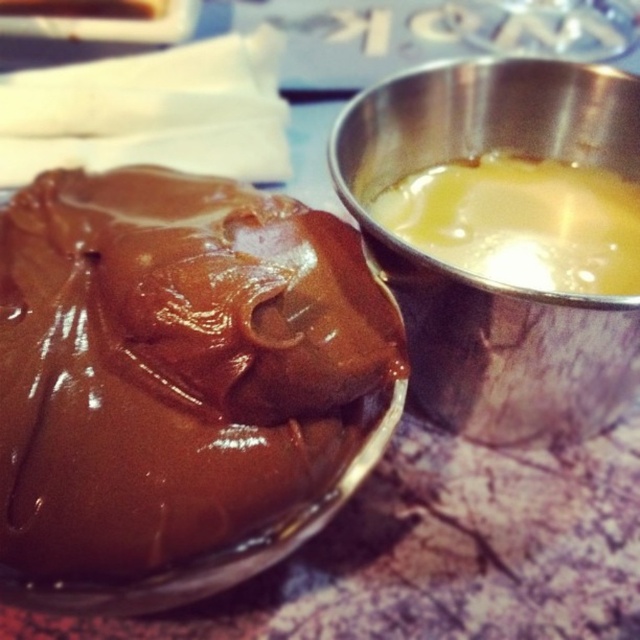
You are a food stylist arranging the dessert setup. You need to pour the metallic yellow liquid at upper right into the yellow translucent liquid at upper right without spilling. Which liquid should you pour first?

You should pour the metallic yellow liquid at upper right first because it is in front of the yellow translucent liquid at upper right, allowing you to pour it into the latter without obstructing the view or causing spillage.

You are a chef trying to place a new dessert plate between the shiny brown chocolate at left and the yellow translucent liquid at upper right. Based on their positions, which one should you move to make space?

The shiny brown chocolate at left is in front of the yellow translucent liquid at upper right, so you should move the shiny brown chocolate at left to create space between them.

You are a food stylist arranging two liquids on a table. You have a metallic yellow liquid at upper right and a yellow translucent liquid at upper right. The table has limited space. Which liquid should you move to prevent them from overlapping?

You should move the metallic yellow liquid at upper right because it has a larger width than the yellow translucent liquid at upper right, so it occupies more space and is more likely to cause overlap.